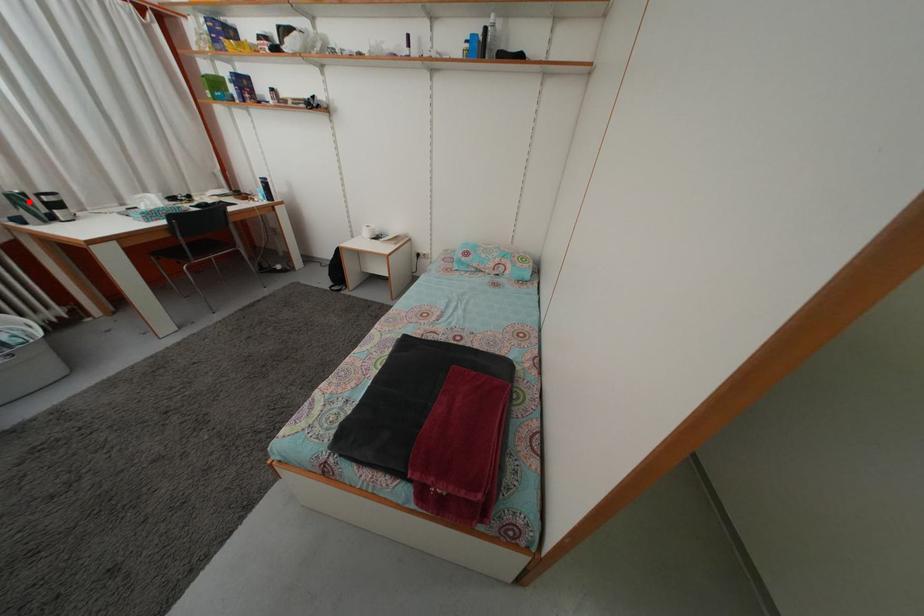
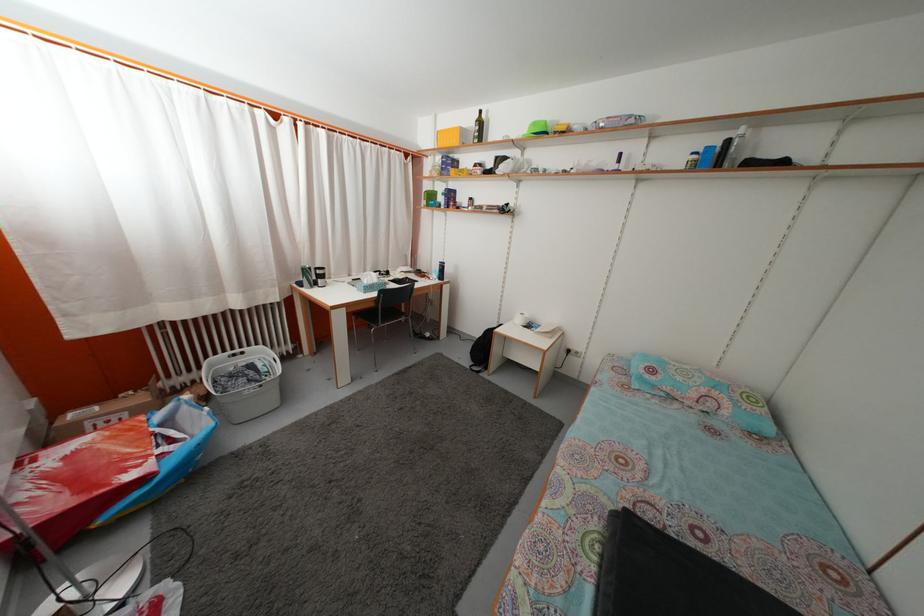
Where in the second image is the point corresponding to the highlighted location from the first image?

(315, 276)